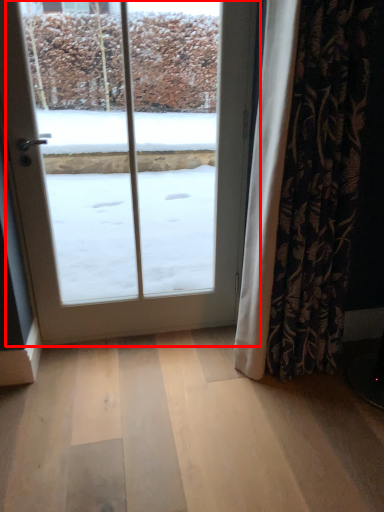
Question: Observing the image, what is the correct spatial positioning of door (annotated by the red box) in reference to curtain?

Choices:
 (A) left
 (B) right

Answer: (A)